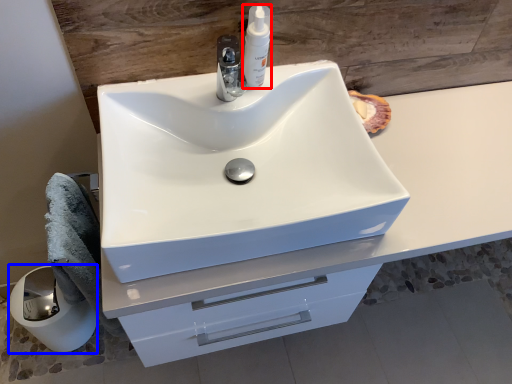
Question: Which of the following is the closest to the observer, soap dispenser (highlighted by a red box) or paper towel (highlighted by a blue box)?

Choices:
 (A) soap dispenser
 (B) paper towel

Answer: (A)